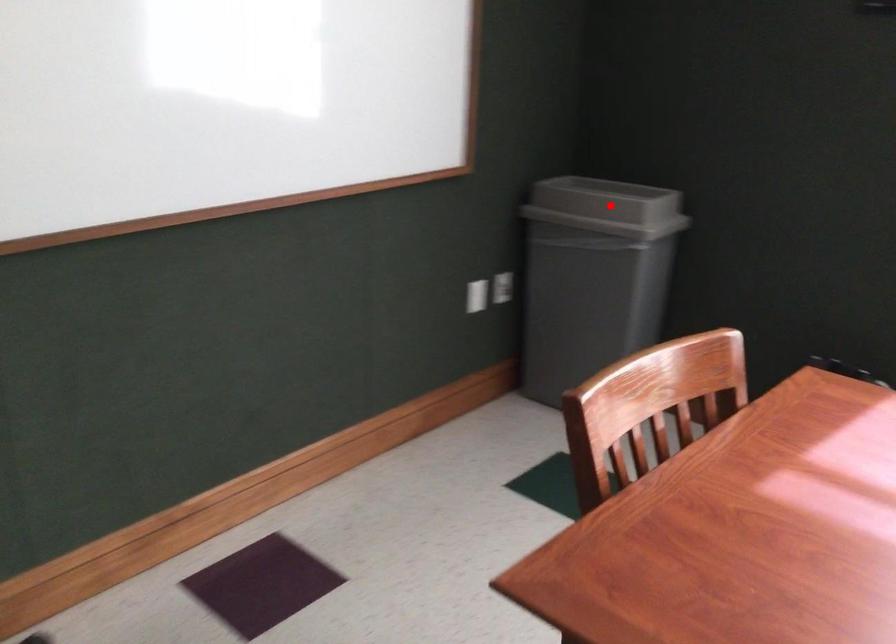
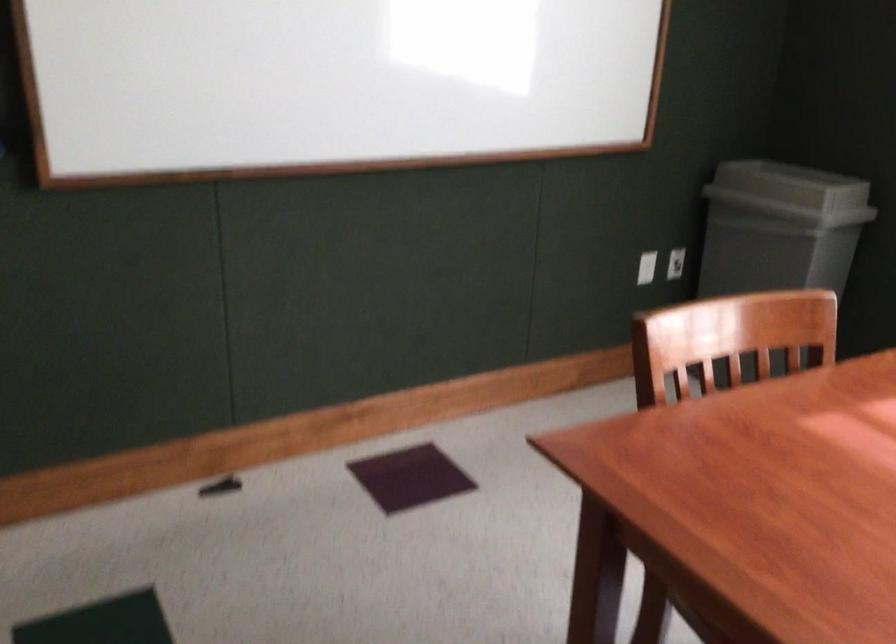
Locate, in the second image, the point that corresponds to the highlighted location in the first image.

(791, 185)